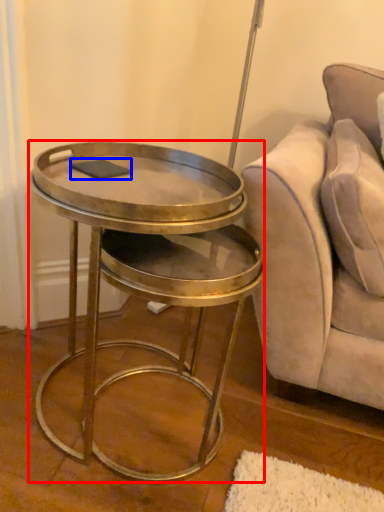
Question: Which point is closer to the camera, table (highlighted by a red box) or pad (highlighted by a blue box)?

Choices:
 (A) table
 (B) pad

Answer: (A)